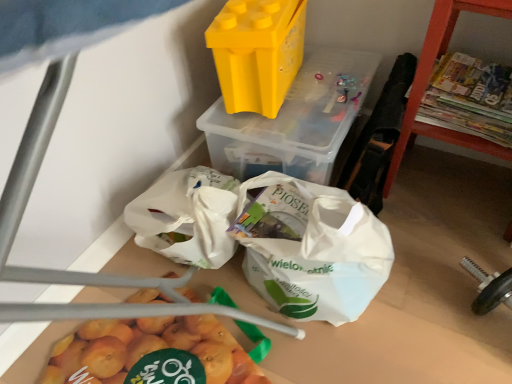
Where is `vacant space in front of orange wood shelf at right`? The height and width of the screenshot is (384, 512). vacant space in front of orange wood shelf at right is located at coordinates (443, 259).